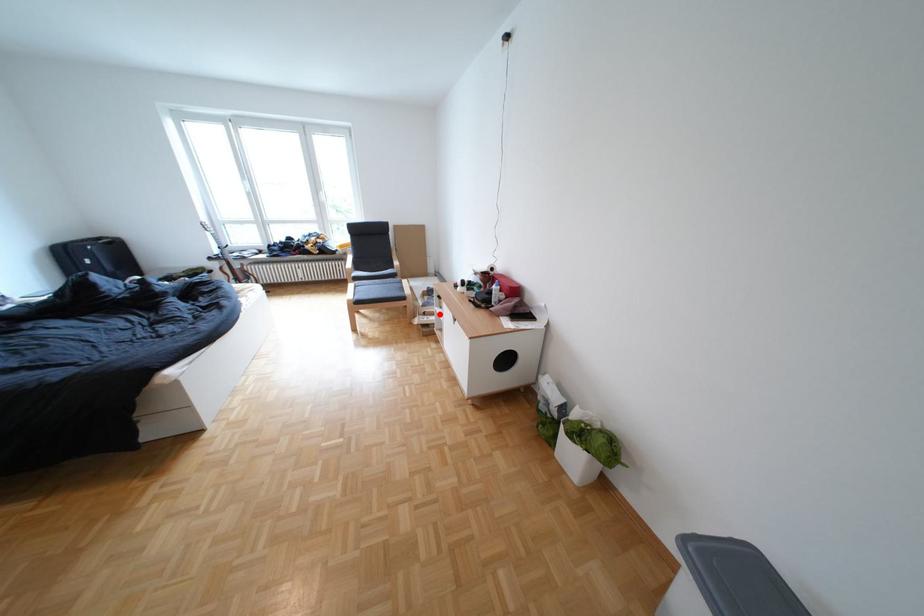
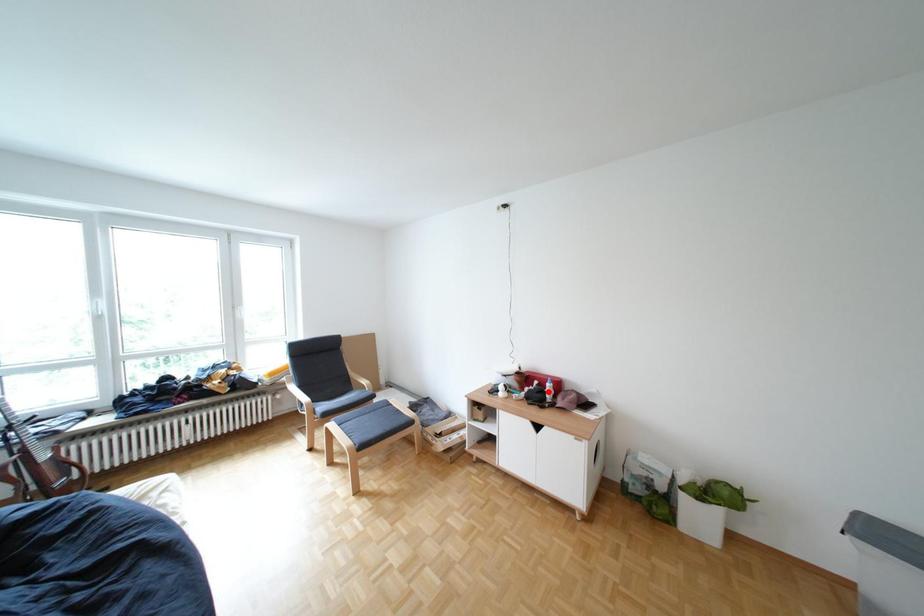
I am providing you with two images of the same scene from different viewpoints. A red point is marked on the first image and another point is marked on the second image. Is the marked point in image1 the same physical position as the marked point in image2?

No